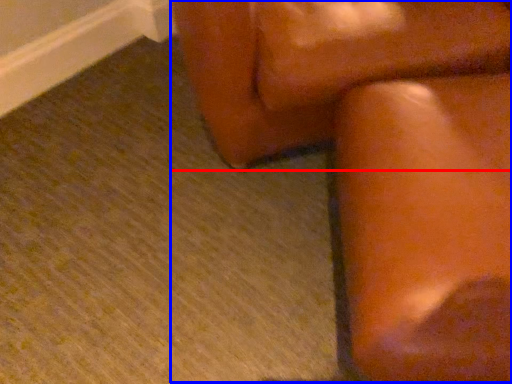
Question: Which of the following is the farthest to the observer, furniture (highlighted by a red box) or rocking chair (highlighted by a blue box)?

Choices:
 (A) furniture
 (B) rocking chair

Answer: (A)